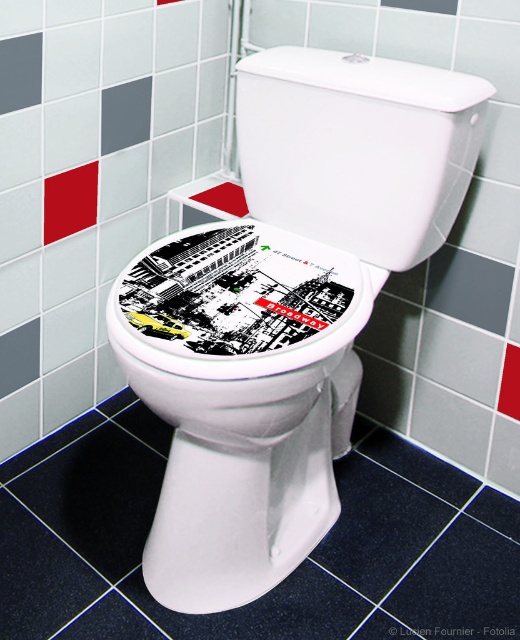
Question: Does white glossy toilet bowl at center have a lesser width compared to black glossy sticker at center?

Choices:
 (A) no
 (B) yes

Answer: (A)

Question: Can you confirm if black glossy sticker at center is positioned below white glossy toilet lid at upper center?

Choices:
 (A) yes
 (B) no

Answer: (A)

Question: Which of the following is the closest to the observer?

Choices:
 (A) black glossy sticker at center
 (B) white glossy toilet lid at upper center
 (C) white glossy toilet bowl at center

Answer: (A)

Question: Does white glossy toilet bowl at center have a smaller size compared to white glossy toilet lid at upper center?

Choices:
 (A) no
 (B) yes

Answer: (A)

Question: Which of the following is the closest to the observer?

Choices:
 (A) white glossy toilet lid at upper center
 (B) white glossy toilet bowl at center

Answer: (B)

Question: Which point is closer to the camera?

Choices:
 (A) white glossy toilet lid at upper center
 (B) black glossy sticker at center
 (C) white glossy toilet bowl at center

Answer: (B)